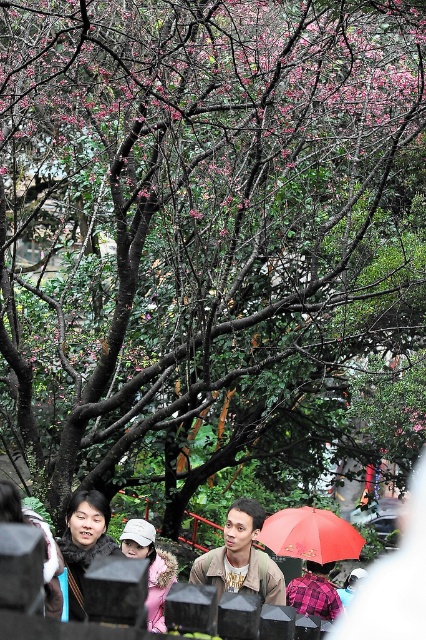
Does brown leather jacket at center have a larger size compared to red matte umbrella at center?

Incorrect, brown leather jacket at center is not larger than red matte umbrella at center.

Does brown leather jacket at center have a greater width compared to red matte umbrella at center?

No.

At what (x,y) coordinates should I click in order to perform the action: click on brown leather jacket at center. Please return your answer as a coordinate pair (x, y). Looking at the image, I should click on (241, 557).

Which of these two, red matte umbrella at center or pink fabric hat at lower center, stands shorter?

With less height is red matte umbrella at center.

Measure the distance between red matte umbrella at center and pink fabric hat at lower center.

7.12 meters

Where is `red matte umbrella at center`? This screenshot has width=426, height=640. red matte umbrella at center is located at coordinates (310, 534).

The image size is (426, 640). Identify the location of red matte umbrella at center. (310, 534).

Does matte black jacket at lower left appear on the right side of pink fabric hat at lower center?

In fact, matte black jacket at lower left is to the left of pink fabric hat at lower center.

This screenshot has height=640, width=426. What do you see at coordinates (83, 541) in the screenshot? I see `matte black jacket at lower left` at bounding box center [83, 541].

Does point (77, 582) come behind point (152, 563)?

That is False.

Where is `matte black jacket at lower left`? The width and height of the screenshot is (426, 640). matte black jacket at lower left is located at coordinates (83, 541).